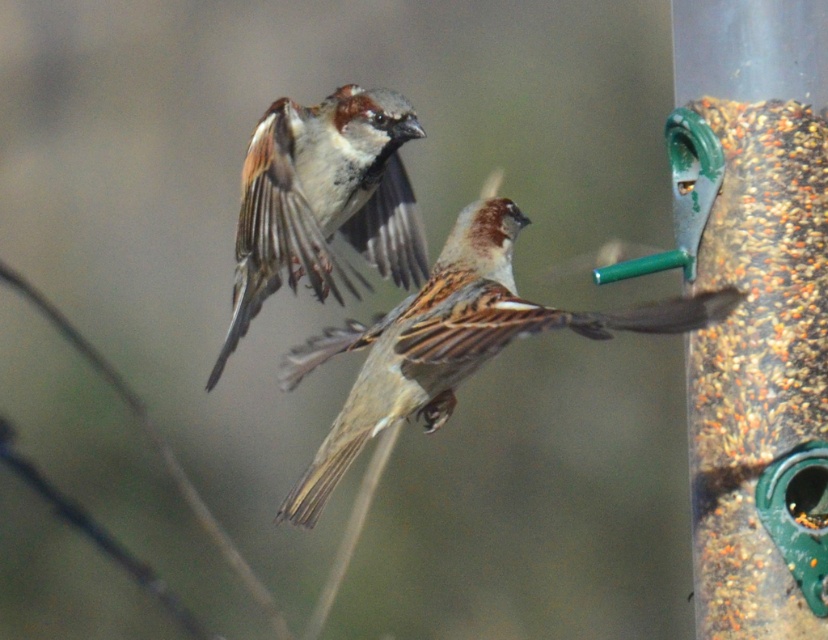
Question: Does brown feathered sparrow at center come behind brown feathered sparrow at upper center?

Choices:
 (A) yes
 (B) no

Answer: (B)

Question: Which point is closer to the camera?

Choices:
 (A) brown feathered sparrow at upper center
 (B) brown feathered sparrow at center

Answer: (B)

Question: Is brown feathered sparrow at center positioned before brown feathered sparrow at upper center?

Choices:
 (A) no
 (B) yes

Answer: (B)

Question: Is brown feathered sparrow at center further to camera compared to brown feathered sparrow at upper center?

Choices:
 (A) yes
 (B) no

Answer: (B)

Question: Among these objects, which one is farthest from the camera?

Choices:
 (A) brown feathered sparrow at upper center
 (B) brown feathered sparrow at center

Answer: (A)